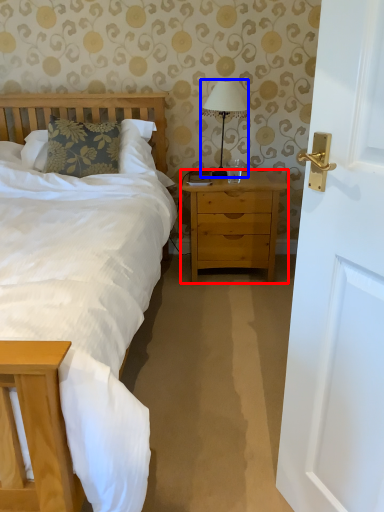
Question: Which point is further to the camera, nightstand (highlighted by a red box) or bedside lamp (highlighted by a blue box)?

Choices:
 (A) nightstand
 (B) bedside lamp

Answer: (A)